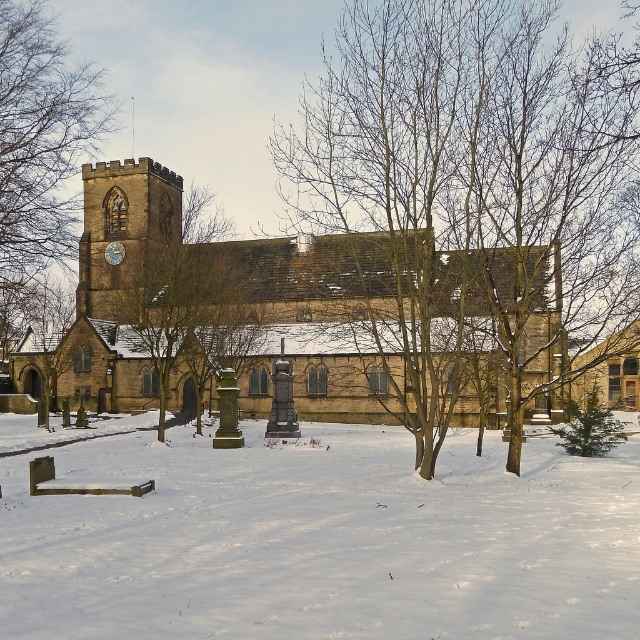
Question: Which is farther from the blue painted metal clock at upper left?

Choices:
 (A) brown wood tree at center
 (B) brown wood tree at upper left

Answer: (A)

Question: Can you confirm if white powdery snow at lower center is positioned below green textured evergreen tree at lower right?

Choices:
 (A) yes
 (B) no

Answer: (A)

Question: Does white powdery snow at lower center have a greater width compared to brown wood tree at upper left?

Choices:
 (A) no
 (B) yes

Answer: (B)

Question: Observing the image, what is the correct spatial positioning of white powdery snow at lower center in reference to green textured evergreen tree at lower right?

Choices:
 (A) left
 (B) right

Answer: (A)

Question: Which object is farther from the camera taking this photo?

Choices:
 (A) white powdery snow at lower center
 (B) brown stone church at center
 (C) brown wood tree at upper left

Answer: (C)

Question: Which point appears farthest from the camera in this image?

Choices:
 (A) (115, 241)
 (B) (275, 604)

Answer: (A)